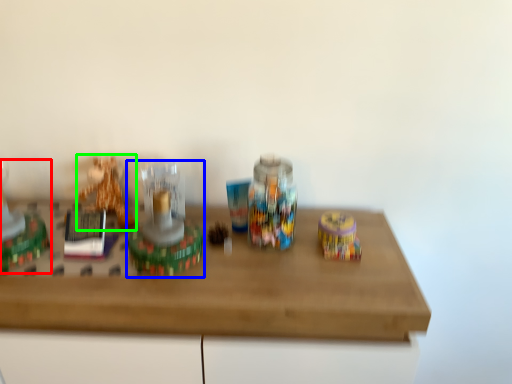
Question: Estimate the real-world distances between objects in this image. Which object is farther from toy (highlighted by a red box), toy (highlighted by a blue box) or toy (highlighted by a green box)?

Choices:
 (A) toy
 (B) toy

Answer: (A)